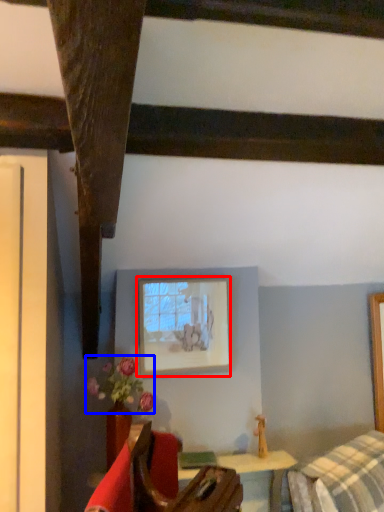
Question: Which of the following is the closest to the observer, picture frame (highlighted by a red box) or flower (highlighted by a blue box)?

Choices:
 (A) picture frame
 (B) flower

Answer: (B)